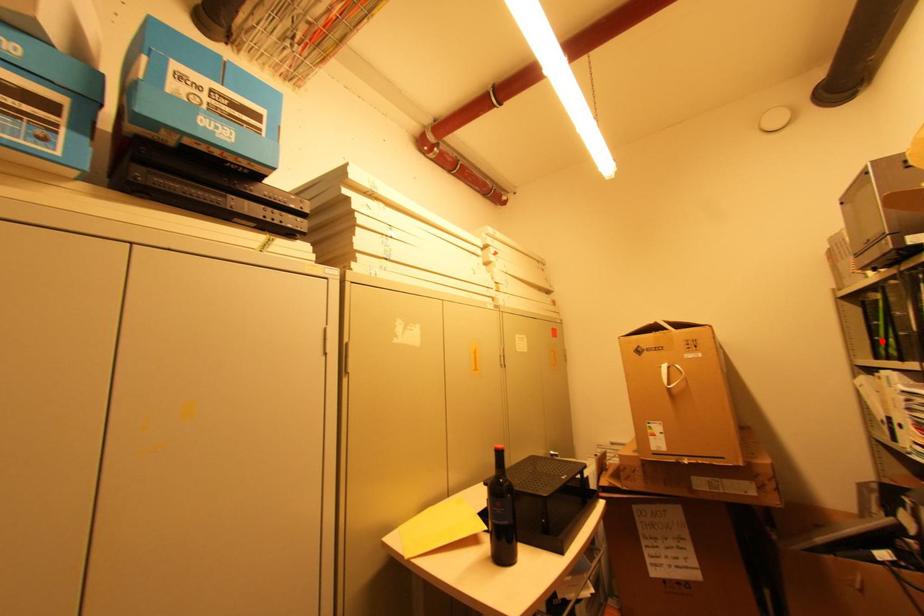
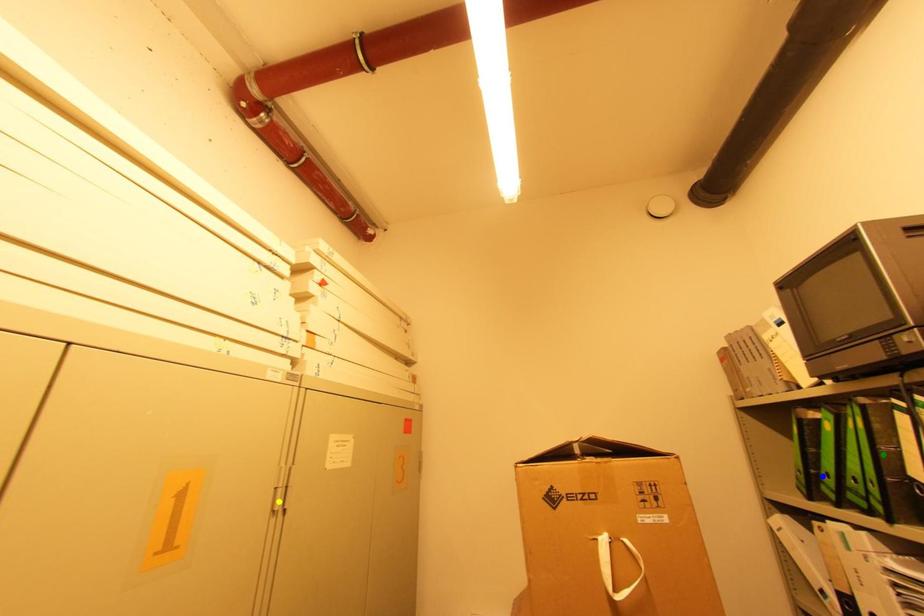
Question: I am providing you with two images of the same scene from different viewpoints. A red point is marked on the first image. You are given multiple points on the second image. In image 2, which mark is for the same physical point as the one in image 1?

Choices:
 (A) blue point
 (B) green point
 (C) yellow point

Answer: (A)